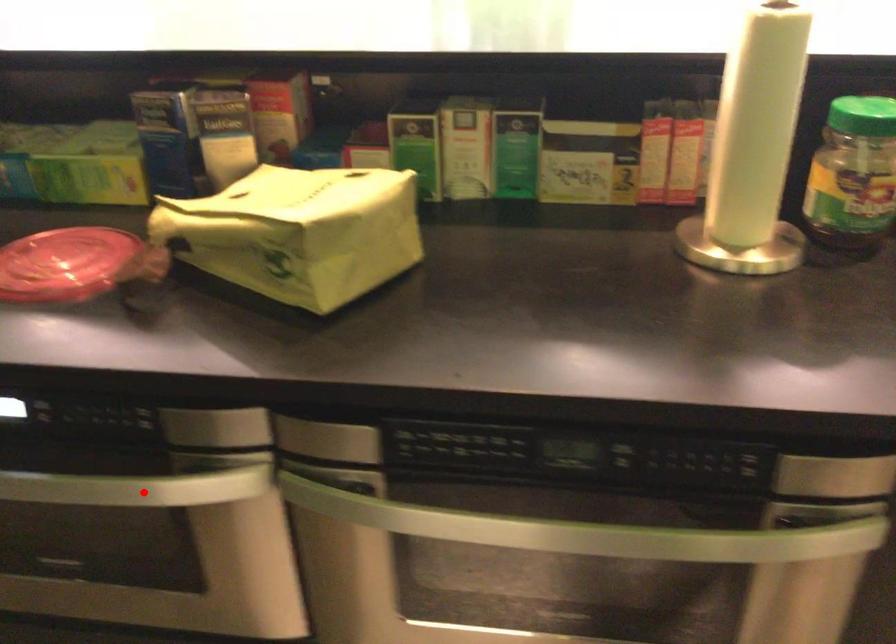
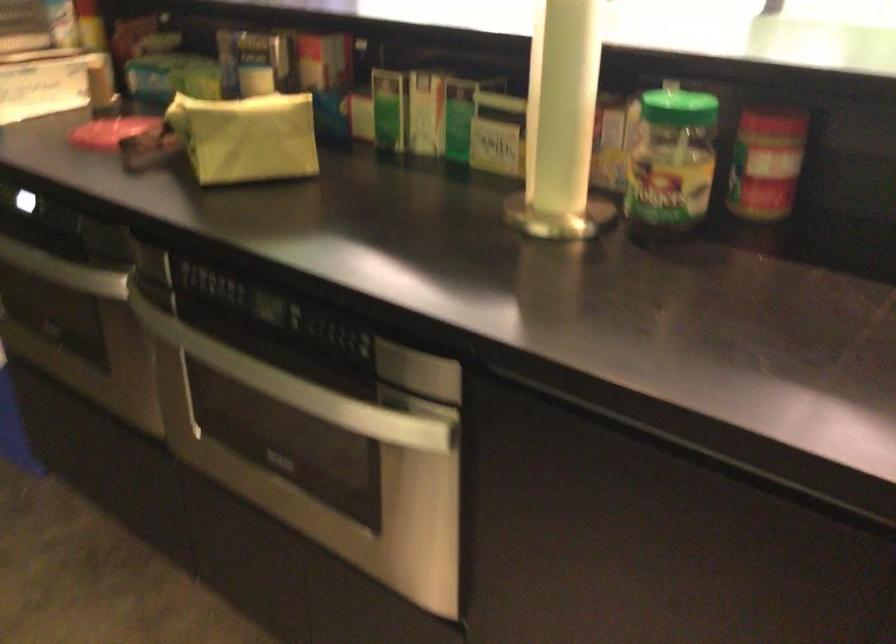
Where in the second image is the point corresponding to the highlighted location from the first image?

(64, 270)